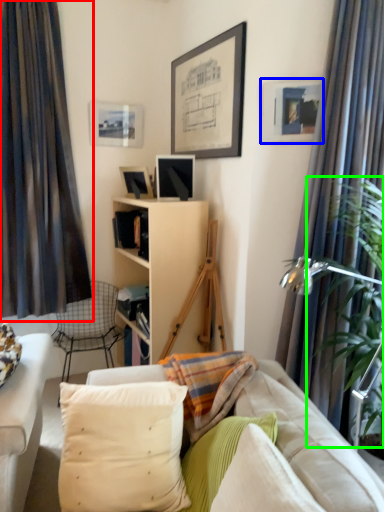
Question: Which object is the farthest from curtain (highlighted by a red box)? Choose among these: picture frame (highlighted by a blue box) or plant (highlighted by a green box).

Choices:
 (A) picture frame
 (B) plant

Answer: (B)